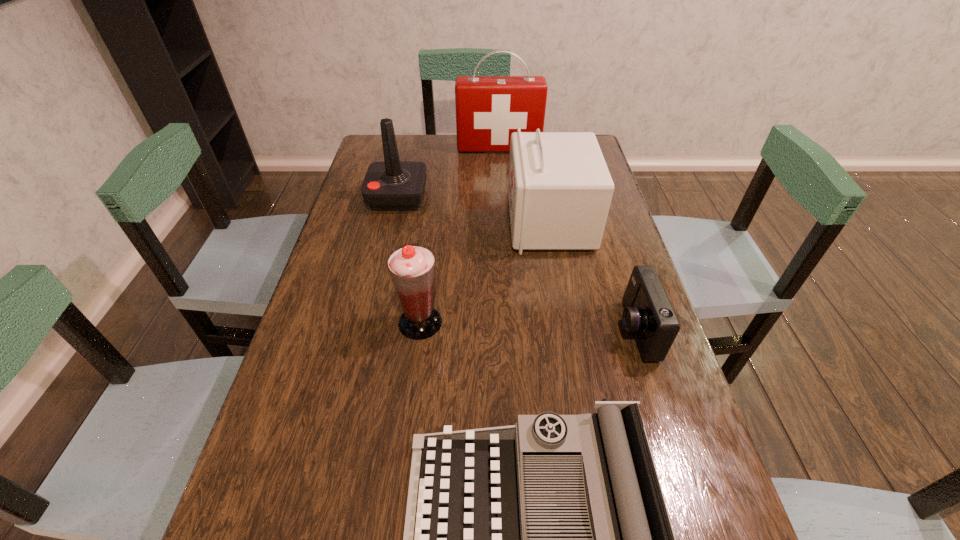
Where is `vacant space situated 0.290m on the back of the joystick`? The height and width of the screenshot is (540, 960). vacant space situated 0.290m on the back of the joystick is located at coordinates (411, 138).

Where is `free spot located on the left of the smoothie`? free spot located on the left of the smoothie is located at coordinates (313, 322).

Find the location of a particular element. Image resolution: width=960 pixels, height=540 pixels. vacant space located 0.120m on the front-facing side of the camera is located at coordinates (564, 330).

The image size is (960, 540). In order to click on vacant space located on the front-facing side of the camera in this screenshot , I will do `click(530, 330)`.

Locate an element on the screen. free space located on the front-facing side of the camera is located at coordinates (556, 330).

The image size is (960, 540). In order to click on object present at the far edge in this screenshot , I will do `click(489, 109)`.

Locate an element on the screen. This screenshot has height=540, width=960. object that is positioned at the left edge is located at coordinates (391, 185).

Identify the location of the first-aid kit that is at the right edge. The height and width of the screenshot is (540, 960). (559, 189).

Where is `camera situated at the right edge`? The height and width of the screenshot is (540, 960). camera situated at the right edge is located at coordinates (648, 313).

This screenshot has width=960, height=540. In the image, there is a desktop. In order to click on vacant space at the far edge in this screenshot , I will do `click(495, 160)`.